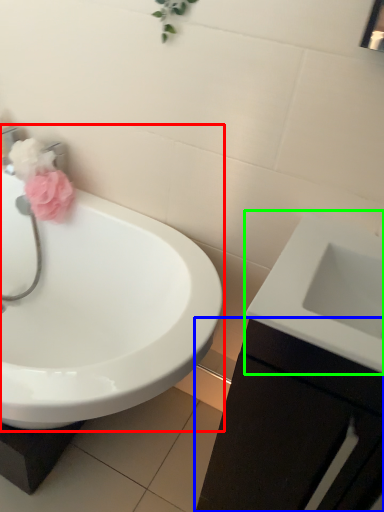
Question: Which object is positioned closest to sink (highlighted by a red box)? Select from bathroom cabinet (highlighted by a blue box) and sink (highlighted by a green box).

Choices:
 (A) bathroom cabinet
 (B) sink

Answer: (A)